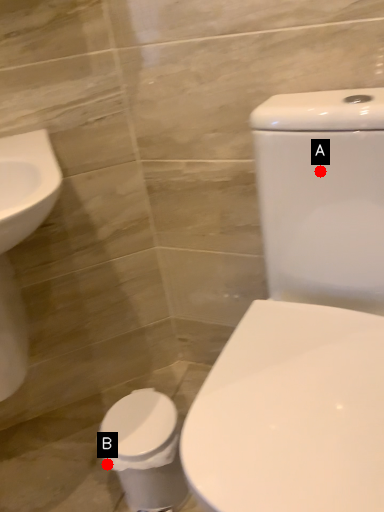
Question: Two points are circled on the image, labeled by A and B beside each circle. Which of the following is the closest to the observer?

Choices:
 (A) A is closer
 (B) B is closer

Answer: (A)